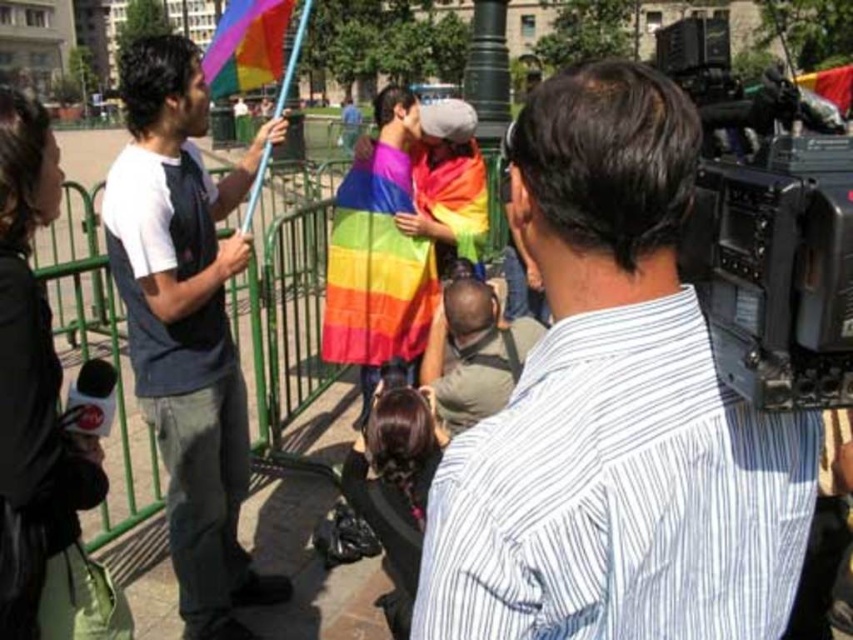
Question: Which point is farther from the camera taking this photo?

Choices:
 (A) (157, 45)
 (B) (262, 26)
 (C) (643, 618)
 (D) (849, 115)

Answer: (D)

Question: In this image, where is white striped shirt at upper right located relative to dark brown leather jacket at center?

Choices:
 (A) below
 (B) above

Answer: (B)

Question: Which point is farther from the camera taking this photo?

Choices:
 (A) (372, 154)
 (B) (219, 40)
 (C) (810, 179)

Answer: (A)

Question: Is white cotton t-shirt at left to the right of rainbow fabric flag at center from the viewer's perspective?

Choices:
 (A) no
 (B) yes

Answer: (A)

Question: Among these objects, which one is farthest from the camera?

Choices:
 (A) black plastic video camera at right
 (B) rainbow fabric flag at center

Answer: (B)

Question: Can you confirm if white striped shirt at upper right is positioned below black plastic video camera at right?

Choices:
 (A) no
 (B) yes

Answer: (B)